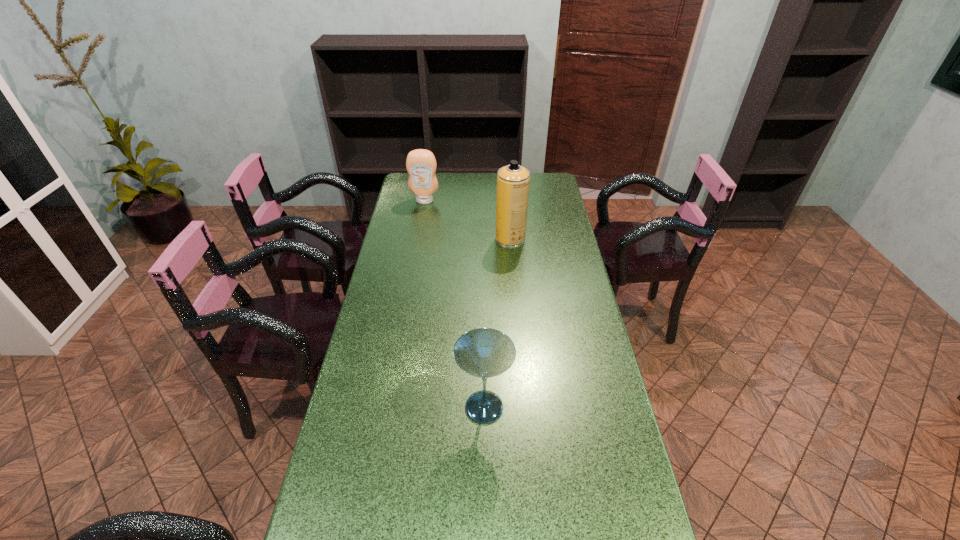
Point out which object is positioned as the second nearest to the leftmost object. Please provide its 2D coordinates. Your answer should be formatted as a tuple, i.e. [(x, y)], where the tuple contains the x and y coordinates of a point satisfying the conditions above.

[(483, 352)]

The height and width of the screenshot is (540, 960). Find the location of `free space in the image that satisfies the following two spatial constraints: 1. on the label of the farthest object; 2. on the left side of the second farthest object`. free space in the image that satisfies the following two spatial constraints: 1. on the label of the farthest object; 2. on the left side of the second farthest object is located at coordinates (418, 239).

This screenshot has height=540, width=960. I want to click on free spot that satisfies the following two spatial constraints: 1. on the label of the nearest object; 2. on the right side of the condiment, so click(x=388, y=407).

Locate an element on the screen. This screenshot has width=960, height=540. vacant space that satisfies the following two spatial constraints: 1. on the label of the nearest object; 2. on the left side of the farthest object is located at coordinates (388, 407).

At what (x,y) coordinates should I click in order to perform the action: click on free spot that satisfies the following two spatial constraints: 1. on the label of the farthest object; 2. on the right side of the nearest object. Please return your answer as a coordinate pair (x, y). Looking at the image, I should click on (388, 407).

Locate an element on the screen. The width and height of the screenshot is (960, 540). vacant point that satisfies the following two spatial constraints: 1. on the label of the nearest object; 2. on the left side of the leftmost object is located at coordinates (388, 407).

Find the location of `vacant space that satisfies the following two spatial constraints: 1. on the back side of the nearest object; 2. on the left side of the tallest object`. vacant space that satisfies the following two spatial constraints: 1. on the back side of the nearest object; 2. on the left side of the tallest object is located at coordinates pos(483,239).